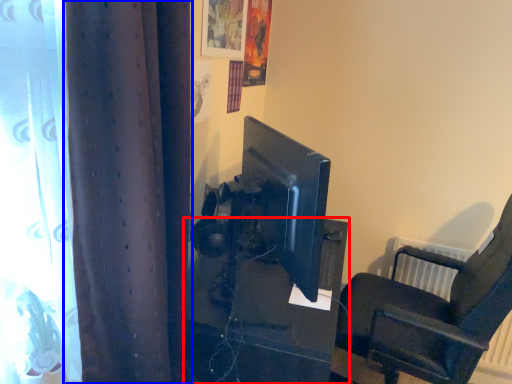
Question: Which of the following is the closest to the observer, furniture (highlighted by a red box) or curtain (highlighted by a blue box)?

Choices:
 (A) furniture
 (B) curtain

Answer: (B)